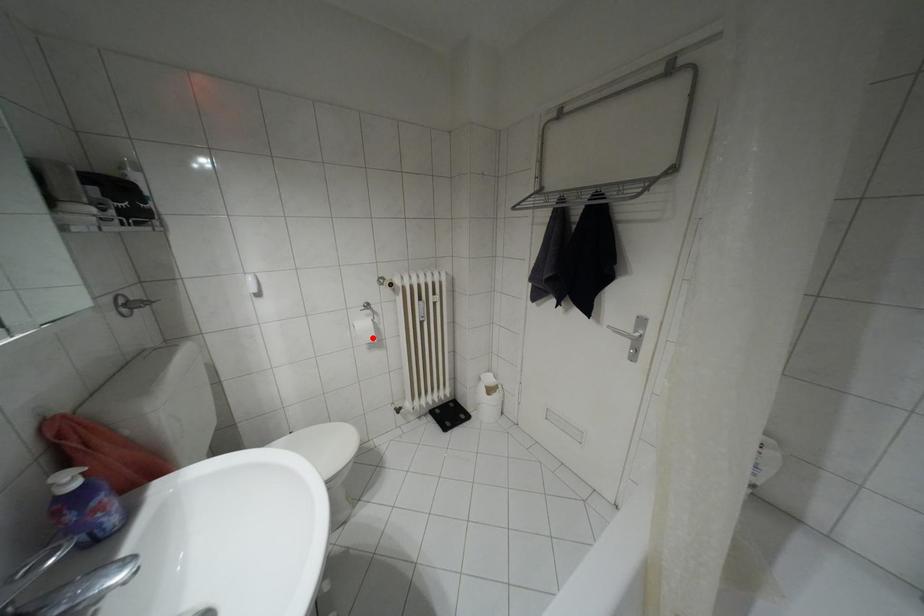
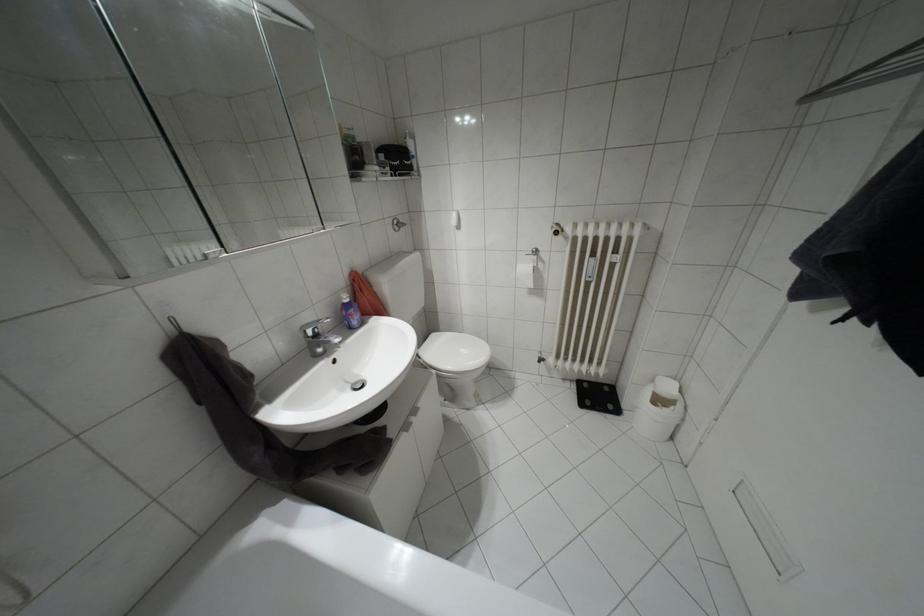
In the second image, find the point that corresponds to the highlighted location in the first image.

(530, 284)